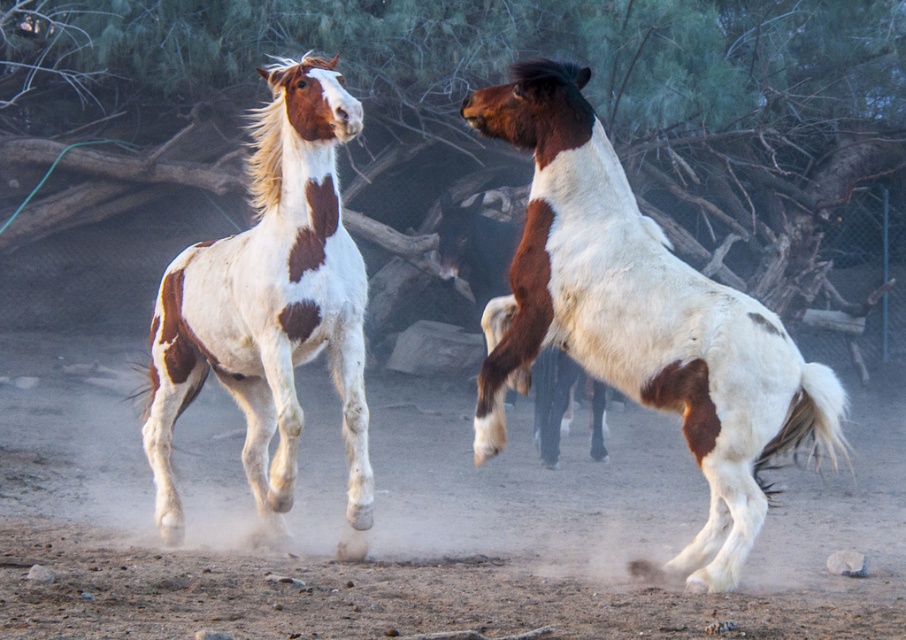
Question: Does white-brown speckled horse at center appear on the left side of white speckled horse at left?

Choices:
 (A) yes
 (B) no

Answer: (B)

Question: Considering the real-world distances, which object is closest to the white-brown speckled horse at center?

Choices:
 (A) brown and white speckled horse at right
 (B) white speckled horse at left

Answer: (B)

Question: Is white-brown speckled horse at center above white speckled horse at left?

Choices:
 (A) yes
 (B) no

Answer: (A)

Question: Estimate the real-world distances between objects in this image. Which object is farther from the white-brown speckled horse at center?

Choices:
 (A) brown and white speckled horse at right
 (B) white speckled horse at left

Answer: (A)

Question: Based on their relative distances, which object is nearer to the brown and white speckled horse at right?

Choices:
 (A) white-brown speckled horse at center
 (B) white speckled horse at left

Answer: (B)

Question: Where is white-brown speckled horse at center located in relation to brown and white speckled horse at right in the image?

Choices:
 (A) left
 (B) right

Answer: (B)